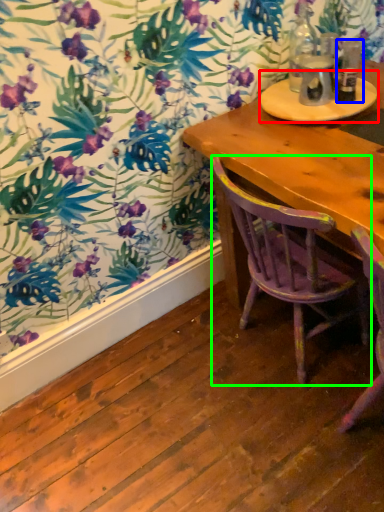
Question: Considering the real-world distances, which object is farthest from round table (highlighted by a red box)? bottle (highlighted by a blue box) or chair (highlighted by a green box)?

Choices:
 (A) bottle
 (B) chair

Answer: (B)